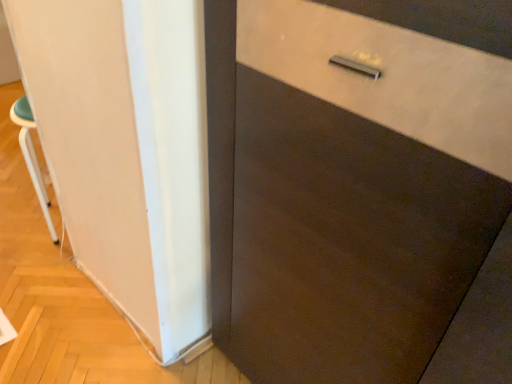
Question: Considering the relative positions of white plastic stool at left and white matte barn door at left in the image provided, is white plastic stool at left to the left or to the right of white matte barn door at left?

Choices:
 (A) left
 (B) right

Answer: (A)

Question: Is point (x=34, y=155) closer or farther from the camera than point (x=89, y=223)?

Choices:
 (A) closer
 (B) farther

Answer: (B)

Question: Considering the positions of white plastic stool at left and white matte barn door at left in the image, is white plastic stool at left wider or thinner than white matte barn door at left?

Choices:
 (A) wide
 (B) thin

Answer: (A)

Question: Looking at the image, does white matte barn door at left seem bigger or smaller compared to white plastic stool at left?

Choices:
 (A) small
 (B) big

Answer: (A)

Question: Is point (96, 142) closer or farther from the camera than point (24, 99)?

Choices:
 (A) farther
 (B) closer

Answer: (B)

Question: Looking at their shapes, would you say white matte barn door at left is wider or thinner than white plastic stool at left?

Choices:
 (A) thin
 (B) wide

Answer: (A)

Question: In terms of height, does white matte barn door at left look taller or shorter compared to white plastic stool at left?

Choices:
 (A) tall
 (B) short

Answer: (A)